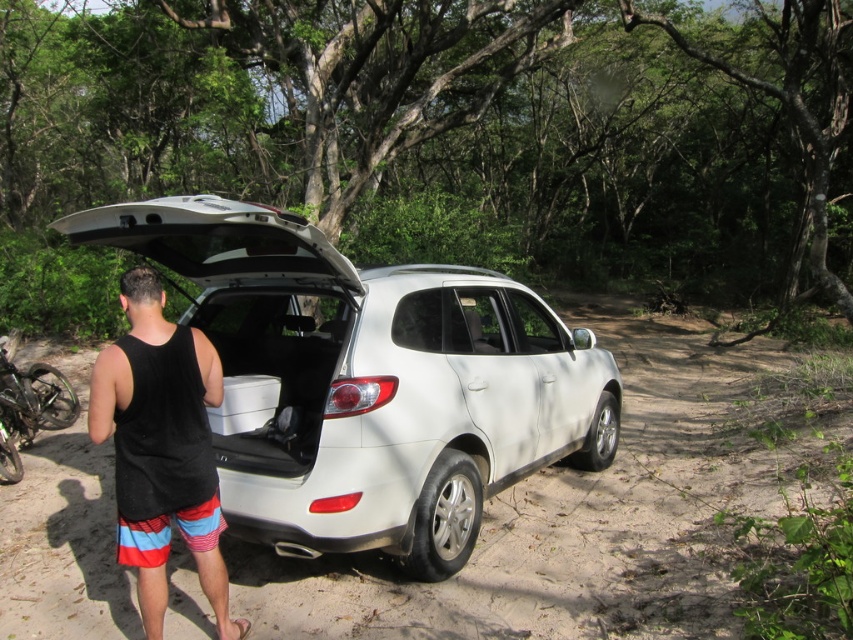
You are standing at the point marked by the coordinates point (x=572, y=520). What is the most likely terrain you are standing on?

The point (x=572, y=520) represents the dirt track at center, so you are most likely standing on a dirt track.

You are a hiker who wants to know where the dirt track at center is located relative to the black fabric tank top at center. Can you tell me which one is below the other?

The dirt track at center is positioned under black fabric tank top at center, so the dirt track at center is below the black fabric tank top at center.